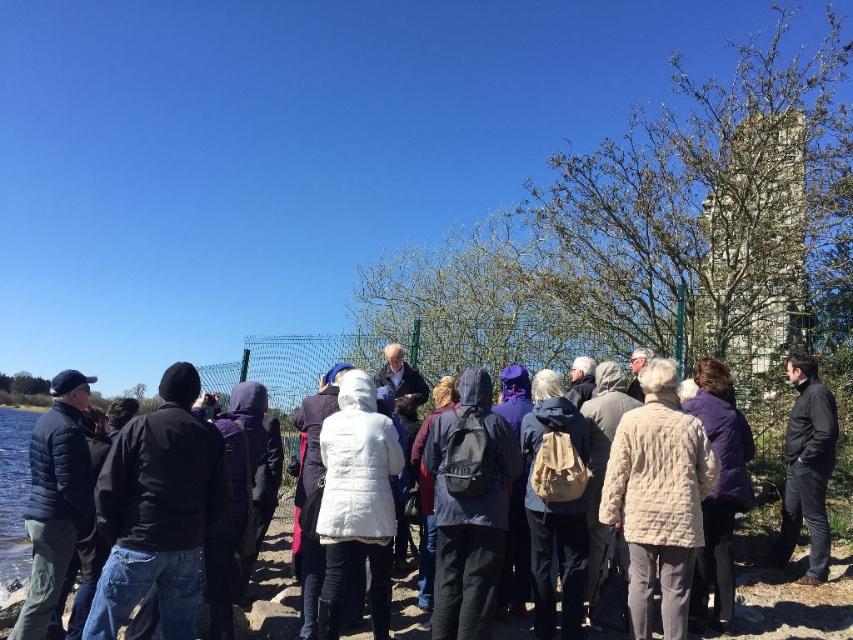
Is point (498, 637) behind point (793, 541)?

That is False.

Who is higher up, white wool coat at center or black matte jacket at lower right?

black matte jacket at lower right is higher up.

Who is more distant from viewer, [781,637] or [802,372]?

Positioned behind is point [802,372].

Find the location of a particular element. This screenshot has width=853, height=640. white wool coat at center is located at coordinates (788, 602).